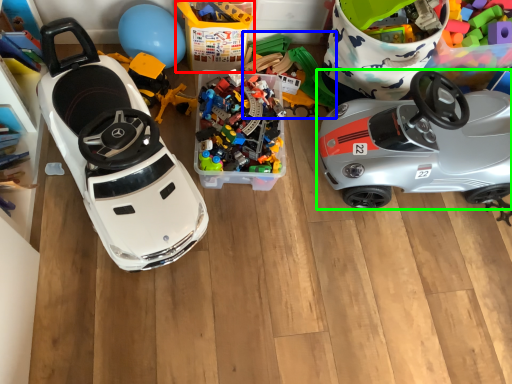
Question: Which object is positioned closest to storage box (highlighted by a red box)? Select from toy (highlighted by a blue box) and car (highlighted by a green box).

Choices:
 (A) toy
 (B) car

Answer: (A)